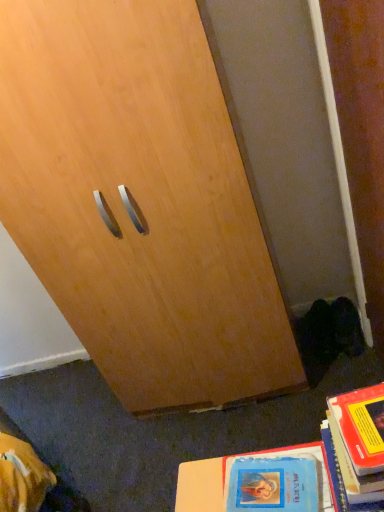
Question: Is blue matte book at lower right, which is the second book from right to left, at the right side of hardcover book at lower right, which is the 2th book from left to right?

Choices:
 (A) no
 (B) yes

Answer: (A)

Question: Is blue matte book at lower right, the first book positioned from the left, smaller than hardcover book at lower right, the 1th book positioned from the right?

Choices:
 (A) yes
 (B) no

Answer: (A)

Question: From a real-world perspective, does blue matte book at lower right, which is the second book from right to left, stand above hardcover book at lower right, which is the 2th book from left to right?

Choices:
 (A) no
 (B) yes

Answer: (A)

Question: Considering the relative sizes of blue matte book at lower right, the first book positioned from the left, and hardcover book at lower right, which is the 2th book from left to right, in the image provided, is blue matte book at lower right, the first book positioned from the left, shorter than hardcover book at lower right, which is the 2th book from left to right,?

Choices:
 (A) yes
 (B) no

Answer: (A)

Question: From a real-world perspective, is blue matte book at lower right, which is the second book from right to left, positioned under hardcover book at lower right, which is the 2th book from left to right, based on gravity?

Choices:
 (A) no
 (B) yes

Answer: (B)

Question: Is blue matte book at lower right, the first book positioned from the left, located outside hardcover book at lower right, the 1th book positioned from the right?

Choices:
 (A) yes
 (B) no

Answer: (A)

Question: Is hardcover book at lower right, which is the 2th book from left to right, positioned beyond the bounds of blue matte book at lower right, the first book positioned from the left?

Choices:
 (A) no
 (B) yes

Answer: (B)

Question: Considering the relative sizes of hardcover book at lower right, the 1th book positioned from the right, and blue matte book at lower right, which is the second book from right to left, in the image provided, is hardcover book at lower right, the 1th book positioned from the right, bigger than blue matte book at lower right, which is the second book from right to left,?

Choices:
 (A) yes
 (B) no

Answer: (A)

Question: Are hardcover book at lower right, the 1th book positioned from the right, and blue matte book at lower right, which is the second book from right to left, located far from each other?

Choices:
 (A) no
 (B) yes

Answer: (A)

Question: Is blue matte book at lower right, which is the second book from right to left, at the back of hardcover book at lower right, the 1th book positioned from the right?

Choices:
 (A) yes
 (B) no

Answer: (B)

Question: Is blue matte book at lower right, the first book positioned from the left, inside hardcover book at lower right, which is the 2th book from left to right?

Choices:
 (A) yes
 (B) no

Answer: (B)

Question: Is the surface of hardcover book at lower right, which is the 2th book from left to right, in direct contact with blue matte book at lower right, the first book positioned from the left?

Choices:
 (A) no
 (B) yes

Answer: (A)

Question: From the image's perspective, relative to hardcover book at lower right, the 1th book positioned from the right, is blue matte book at lower right, which is the second book from right to left, above or below?

Choices:
 (A) above
 (B) below

Answer: (B)